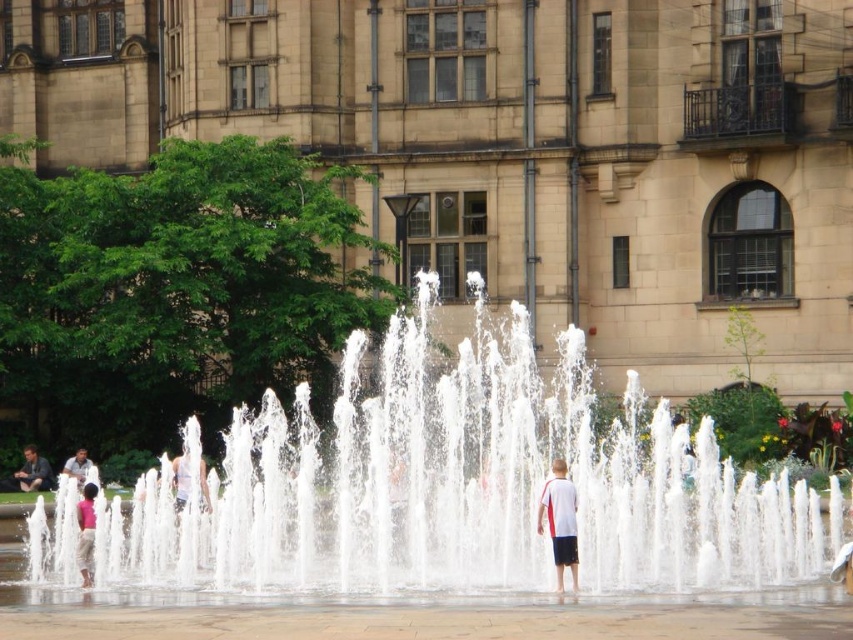
Question: Is white cotton shirt at center thinner than matte gray shirt at lower left?

Choices:
 (A) no
 (B) yes

Answer: (B)

Question: Which object is farther from the camera taking this photo?

Choices:
 (A) light blue shirt at center
 (B) white cotton shirt at center

Answer: (A)

Question: Estimate the real-world distances between objects in this image. Which object is closer to the pink fabric at center?

Choices:
 (A) matte gray shirt at lower left
 (B) white water at center
 (C) light blue shirt at center

Answer: (B)

Question: Which point is farther from the camera taking this photo?

Choices:
 (A) (431, 400)
 (B) (30, 465)
 (C) (82, 536)

Answer: (B)

Question: Is pink fabric at center to the left of matte gray shirt at lower left from the viewer's perspective?

Choices:
 (A) no
 (B) yes

Answer: (A)

Question: Is white cotton shirt at center above matte gray shirt at lower left?

Choices:
 (A) no
 (B) yes

Answer: (B)